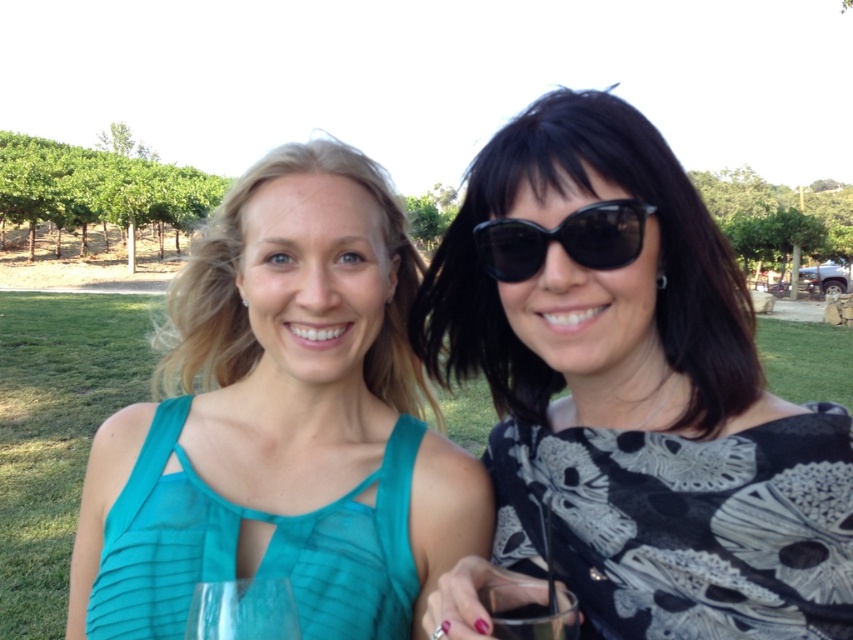
Does point (584, 541) come in front of point (509, 586)?

No, it is behind (509, 586).

Describe the element at coordinates (686, 525) in the screenshot. This screenshot has width=853, height=640. I see `black printed fabric dress at right` at that location.

The width and height of the screenshot is (853, 640). Find the location of `black printed fabric dress at right`. black printed fabric dress at right is located at coordinates [x=686, y=525].

Does black printed fabric dress at right appear on the right side of transparent glass at center?

Indeed, black printed fabric dress at right is positioned on the right side of transparent glass at center.

Is black printed fabric dress at right below transparent glass at center?

Incorrect, black printed fabric dress at right is not positioned below transparent glass at center.

Does point (555, 577) lie in front of point (194, 634)?

That is False.

Locate an element on the screen. Image resolution: width=853 pixels, height=640 pixels. black printed fabric dress at right is located at coordinates (686, 525).

This screenshot has width=853, height=640. What do you see at coordinates (282, 422) in the screenshot? I see `teal fabric dress at center` at bounding box center [282, 422].

Looking at this image, between teal fabric dress at center and clear plastic cup at center, which one has less height?

With less height is clear plastic cup at center.

Between point (161, 634) and point (567, 634), which one is positioned behind?

The point (161, 634) is behind.

The height and width of the screenshot is (640, 853). I want to click on teal fabric dress at center, so point(282,422).